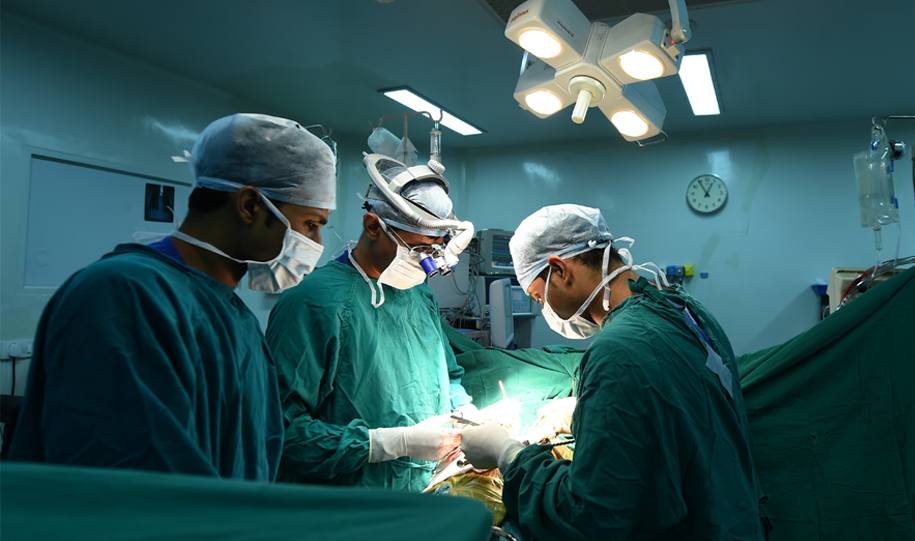
The width and height of the screenshot is (915, 541). I want to click on clock, so click(x=706, y=199).